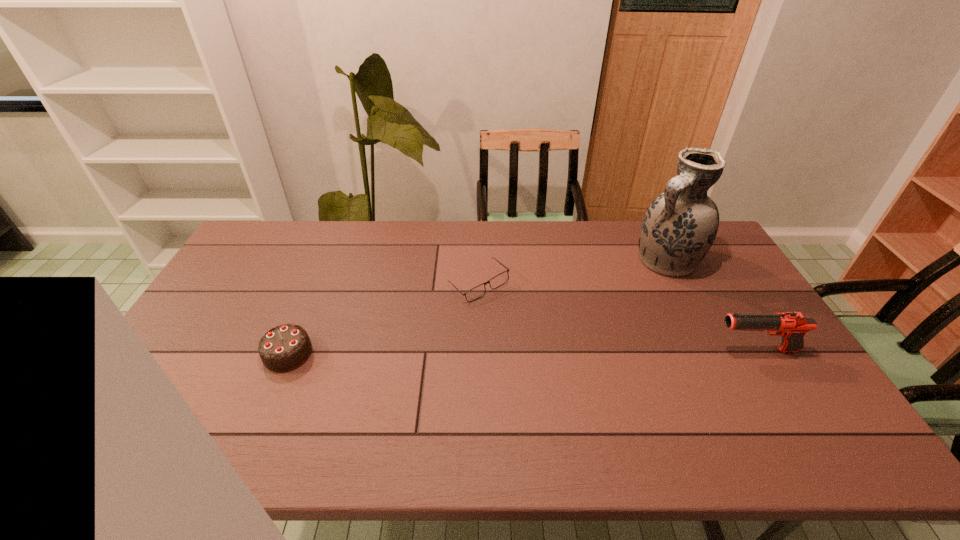
The width and height of the screenshot is (960, 540). Identify the location of free spot on the desktop that is between the leftmost object and the second tallest object and is positioned with the handle on the side of the vase. (547, 352).

Identify the location of free space on the desktop that is between the leftmost object and the gun and is positioned with the lenses facing outward on the shortest object. This screenshot has width=960, height=540. (489, 353).